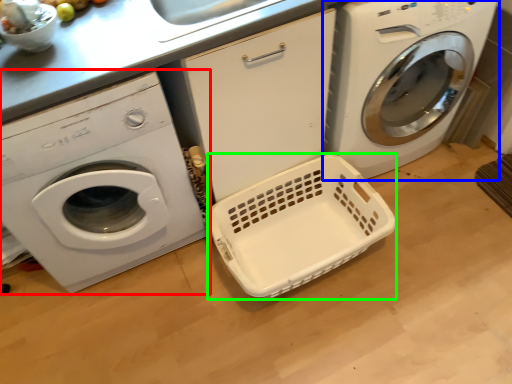
Question: Based on their relative distances, which object is nearer to washing machine (highlighted by a red box)? Choose from washing machine (highlighted by a blue box) and basket container (highlighted by a green box).

Choices:
 (A) washing machine
 (B) basket container

Answer: (B)